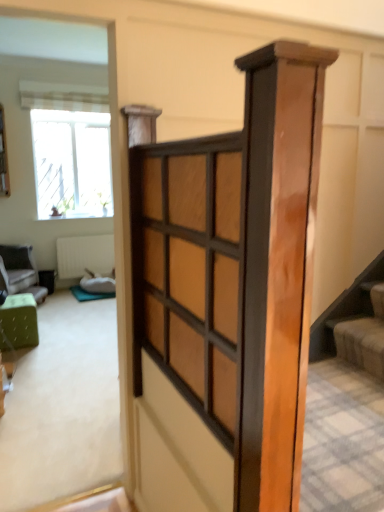
This screenshot has width=384, height=512. What are the coordinates of `empty space that is ontop of green fabric ottoman at left, which is the second furniture in left-to-right order (from a real-world perspective)` in the screenshot? It's located at (11, 301).